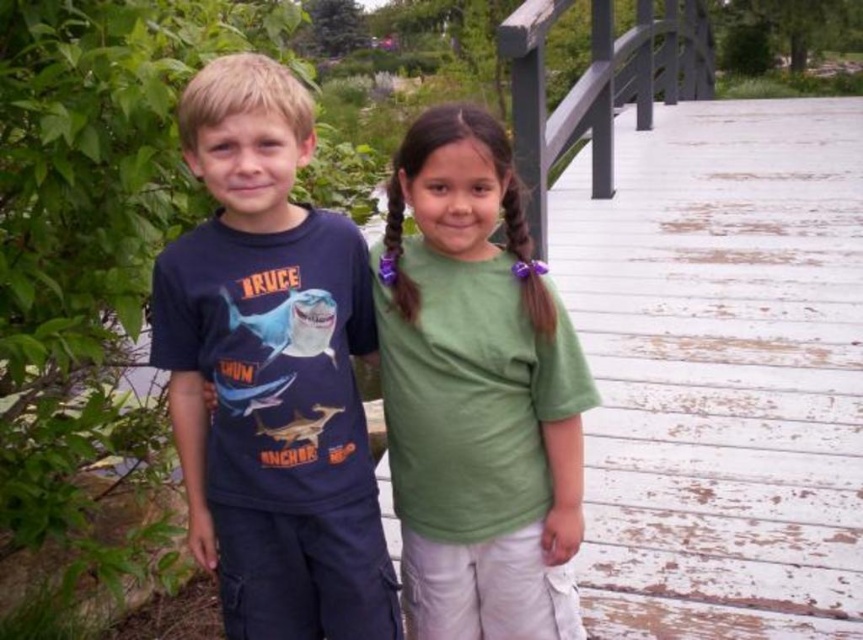
Question: Does green cotton shirt at center have a smaller size compared to wooden balustrade at upper right?

Choices:
 (A) yes
 (B) no

Answer: (A)

Question: Which object is the closest to the matte blue t-shirt at left?

Choices:
 (A) white weathered wood at right
 (B) green cotton shirt at center
 (C) wooden balustrade at upper right

Answer: (B)

Question: Which point is farther to the camera?

Choices:
 (A) (669, 515)
 (B) (545, 353)
 (C) (586, 84)
 (D) (310, 218)

Answer: (C)

Question: Does white weathered wood at right appear over wooden balustrade at upper right?

Choices:
 (A) no
 (B) yes

Answer: (A)

Question: Estimate the real-world distances between objects in this image. Which object is farther from the white weathered wood at right?

Choices:
 (A) wooden balustrade at upper right
 (B) matte blue t-shirt at left

Answer: (B)

Question: Is white weathered wood at right smaller than matte blue t-shirt at left?

Choices:
 (A) no
 (B) yes

Answer: (B)